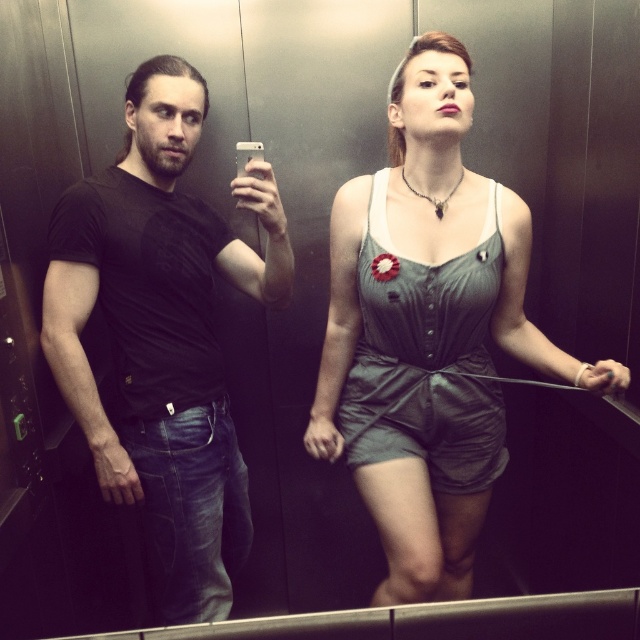
You are inside an elevator and see two points marked in the scene. The first point is at coordinates point [241,566] and the second point is at coordinates point [433,256]. Which point is closer to you?

Point [241,566] is closer to you because it is further to the viewer than point [433,256].